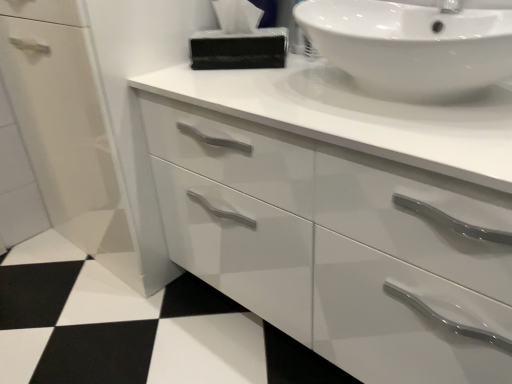
Identify the location of black glossy tissue at upper center. The image size is (512, 384). (239, 40).

Describe the element at coordinates (239, 40) in the screenshot. The height and width of the screenshot is (384, 512). I see `black glossy tissue at upper center` at that location.

Where is `white glossy sink at upper right`? This screenshot has height=384, width=512. white glossy sink at upper right is located at coordinates (411, 47).

Describe the element at coordinates (411, 47) in the screenshot. I see `white glossy sink at upper right` at that location.

You are a GUI agent. You are given a task and a screenshot of the screen. Output one action in this format:
    pyautogui.click(x=<x>, y=<y>)
    Task: Click on the black glossy tissue at upper center
    The width and height of the screenshot is (512, 384).
    Given the screenshot: What is the action you would take?
    pyautogui.click(x=239, y=40)

Which object is positioned more to the left, white glossy sink at upper right or black glossy tissue at upper center?

black glossy tissue at upper center is more to the left.

Which object is closer to the camera, white glossy sink at upper right or black glossy tissue at upper center?

white glossy sink at upper right is closer to the camera.

Which is nearer, (422, 14) or (194, 42)?

Point (422, 14)

From the image's perspective, which object appears higher, white glossy sink at upper right or black glossy tissue at upper center?

black glossy tissue at upper center appears higher in the image.

From a real-world perspective, is white glossy sink at upper right positioned under black glossy tissue at upper center based on gravity?

No, from a real-world perspective, white glossy sink at upper right is not below black glossy tissue at upper center.

Which of these two, white glossy sink at upper right or black glossy tissue at upper center, is wider?

white glossy sink at upper right is wider.

Can you confirm if white glossy sink at upper right is taller than black glossy tissue at upper center?

Correct, white glossy sink at upper right is much taller as black glossy tissue at upper center.

In the scene shown: Is white glossy sink at upper right smaller than black glossy tissue at upper center?

Incorrect, white glossy sink at upper right is not smaller in size than black glossy tissue at upper center.

Consider the image. Is white glossy sink at upper right spatially inside black glossy tissue at upper center, or outside of it?

white glossy sink at upper right is located beyond the bounds of black glossy tissue at upper center.

Is white glossy sink at upper right not close to black glossy tissue at upper center?

That's not correct — white glossy sink at upper right is a little close to black glossy tissue at upper center.

Is white glossy sink at upper right aimed at black glossy tissue at upper center?

No, white glossy sink at upper right is not turned towards black glossy tissue at upper center.

How far apart are white glossy sink at upper right and black glossy tissue at upper center?

white glossy sink at upper right is 32.26 centimeters away from black glossy tissue at upper center.

Find the location of a particular element. The height and width of the screenshot is (384, 512). sink on the right of the black glossy tissue at upper center is located at coordinates (411, 47).

Can you confirm if black glossy tissue at upper center is positioned to the left of white glossy sink at upper right?

Indeed, black glossy tissue at upper center is positioned on the left side of white glossy sink at upper right.

Considering the positions of objects black glossy tissue at upper center and white glossy sink at upper right in the image provided, who is in front, black glossy tissue at upper center or white glossy sink at upper right?

white glossy sink at upper right is more forward.

Is point (239, 57) positioned after point (446, 17)?

Yes, it is behind point (446, 17).

From the image's perspective, is black glossy tissue at upper center located above or below white glossy sink at upper right?

black glossy tissue at upper center is situated higher than white glossy sink at upper right in the image.

In the scene shown: From a real-world perspective, is black glossy tissue at upper center beneath white glossy sink at upper right?

Yes, from a real-world perspective, black glossy tissue at upper center is below white glossy sink at upper right.

Is black glossy tissue at upper center thinner than white glossy sink at upper right?

Yes.

Between black glossy tissue at upper center and white glossy sink at upper right, which one has less height?

Standing shorter between the two is black glossy tissue at upper center.

Considering the sizes of objects black glossy tissue at upper center and white glossy sink at upper right in the image provided, who is bigger, black glossy tissue at upper center or white glossy sink at upper right?

white glossy sink at upper right.

Based on the photo, which is correct: black glossy tissue at upper center is inside white glossy sink at upper right, or outside of it?

The correct answer is: outside.

Are black glossy tissue at upper center and white glossy sink at upper right beside each other?

No, black glossy tissue at upper center is not in contact with white glossy sink at upper right.

Based on the photo, is black glossy tissue at upper center facing towards white glossy sink at upper right?

No, black glossy tissue at upper center does not turn towards white glossy sink at upper right.

Can you tell me how much black glossy tissue at upper center and white glossy sink at upper right differ in facing direction?

The facing directions of black glossy tissue at upper center and white glossy sink at upper right are 35.2 degrees apart.

Locate an element on the screen. tissue lying on the left of white glossy sink at upper right is located at coordinates (239, 40).

Find the location of a particular element. Image resolution: width=512 pixels, height=384 pixels. tissue below the white glossy sink at upper right (from a real-world perspective) is located at coordinates (239, 40).

The image size is (512, 384). Identify the location of sink above the black glossy tissue at upper center (from a real-world perspective). (411, 47).